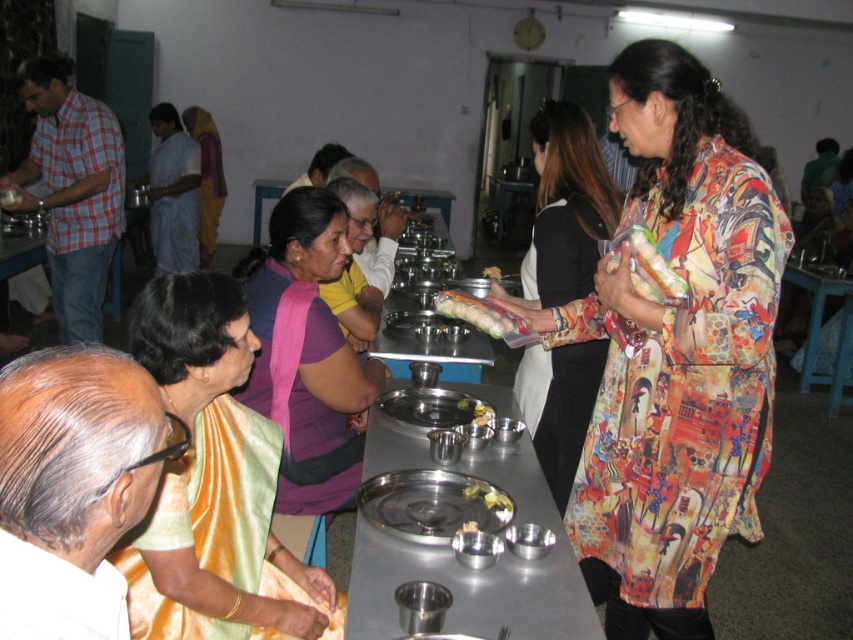
You are a photographer at the event and want to capture both the printed fabric dress at center and the plaid cotton shirt at left in the same frame. Based on their positions, which one should you focus on first to ensure both are in the shot?

The printed fabric dress at center is to the right of the plaid cotton shirt at left, so focusing on the plaid cotton shirt at left first would allow the camera to adjust to the leftmost position, ensuring both subjects are included in the frame.

What is the spatial relationship between the printed fabric dress at center and the point labeled as point (x=566, y=209)?

The printed fabric dress at center is represented by the point labeled point (x=566, y=209).